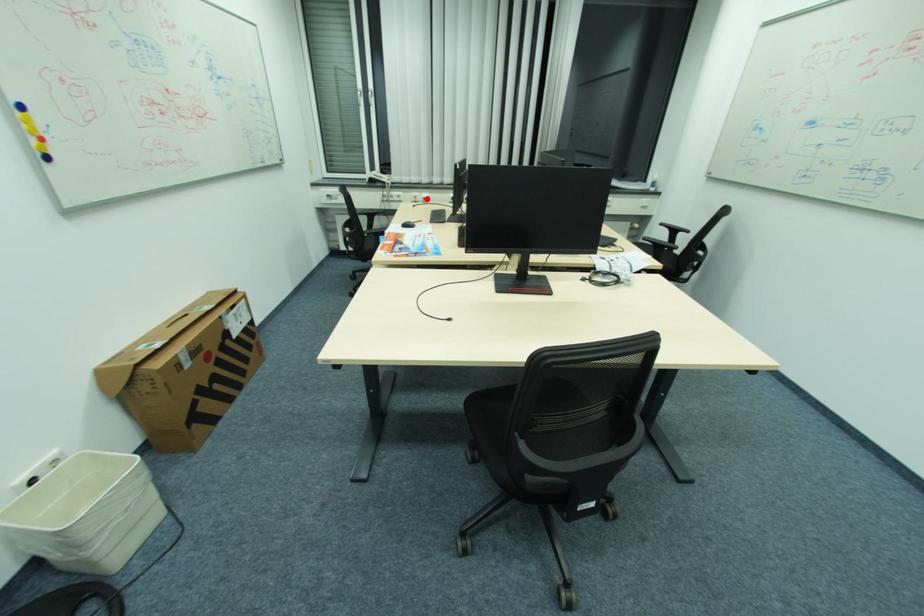
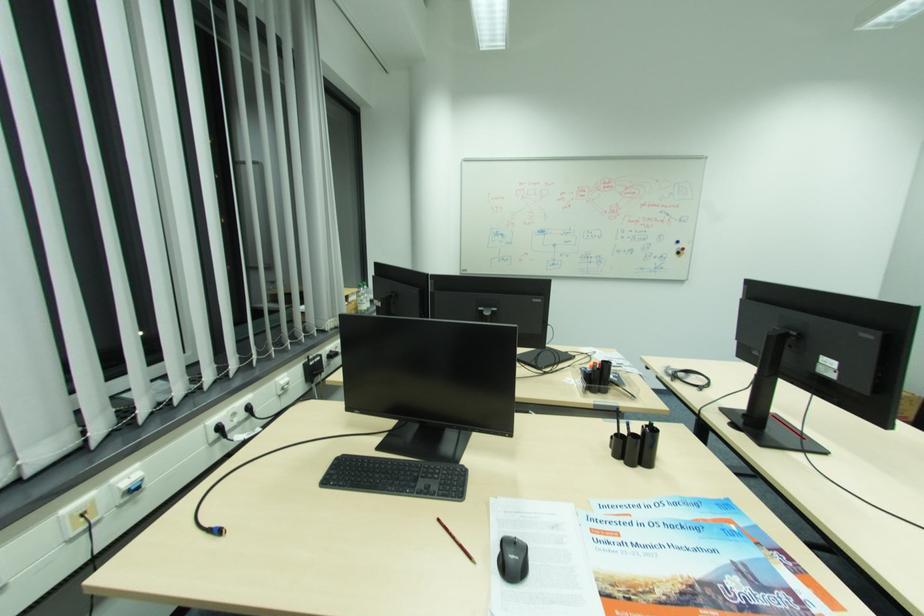
The point at the highlighted location is marked in the first image. Where is the corresponding point in the second image?

(124, 496)